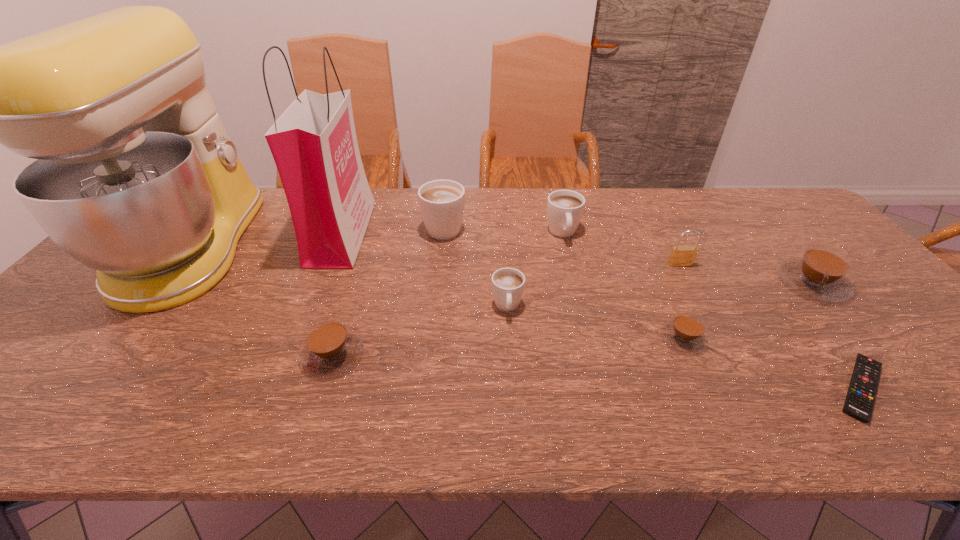
At what (x,y) coordinates should I click in order to perform the action: click on free spot between the third cappuccino from right to left and the second smallest brown cappuccino. Please return your answer as a coordinate pair (x, y). The image size is (960, 540). Looking at the image, I should click on (447, 294).

You are a GUI agent. You are given a task and a screenshot of the screen. Output one action in this format:
    pyautogui.click(x=<x>, y=<y>)
    Task: Click on the free spot between the pink shopping bag and the second smallest brown cappuccino
    
    Given the screenshot: What is the action you would take?
    337,294

Find the location of a particular element. This screenshot has height=540, width=960. free spot between the second brown cappuccino from right to left and the leftmost white cappuccino is located at coordinates (564, 282).

Find the location of `free space between the fourth cappuccino from right to left and the fifth cappuccino from right to left`. free space between the fourth cappuccino from right to left and the fifth cappuccino from right to left is located at coordinates (476, 266).

Image resolution: width=960 pixels, height=540 pixels. In order to click on vacant space that is in between the rightmost cappuccino and the second smallest brown cappuccino in this screenshot , I will do `click(572, 319)`.

Locate an element on the screen. The image size is (960, 540). free spot between the shortest cappuccino and the rightmost cappuccino is located at coordinates (748, 310).

Where is `the fourth closest object to the pink shopping bag`? This screenshot has width=960, height=540. the fourth closest object to the pink shopping bag is located at coordinates (508, 284).

Point out which object is positioned as the sixth nearest to the second smallest brown cappuccino. Please provide its 2D coordinates. Your answer should be formatted as a tuple, i.e. [(x, y)], where the tuple contains the x and y coordinates of a point satisfying the conditions above.

[(686, 332)]

Choose which cappuccino is the third nearest neighbor to the brass padlock. Please provide its 2D coordinates. Your answer should be formatted as a tuple, i.e. [(x, y)], where the tuple contains the x and y coordinates of a point satisfying the conditions above.

[(565, 208)]

Identify the location of cappuccino that can be found as the fourth closest to the second biggest white cappuccino. The width and height of the screenshot is (960, 540). (821, 273).